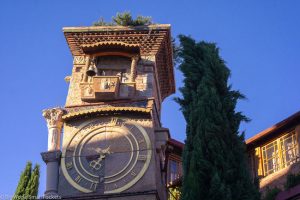
At what (x,y) coordinates should I click in order to perform the action: click on windows. Please return your answer as a coordinate pair (x, y). The width and height of the screenshot is (300, 200). Looking at the image, I should click on (284, 153), (175, 173), (271, 161), (110, 72).